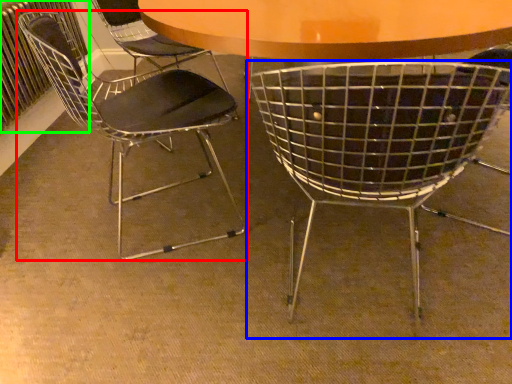
Question: Estimate the real-world distances between objects in this image. Which object is farther from chair (highlighted by a red box), chair (highlighted by a blue box) or radiator (highlighted by a green box)?

Choices:
 (A) chair
 (B) radiator

Answer: (A)